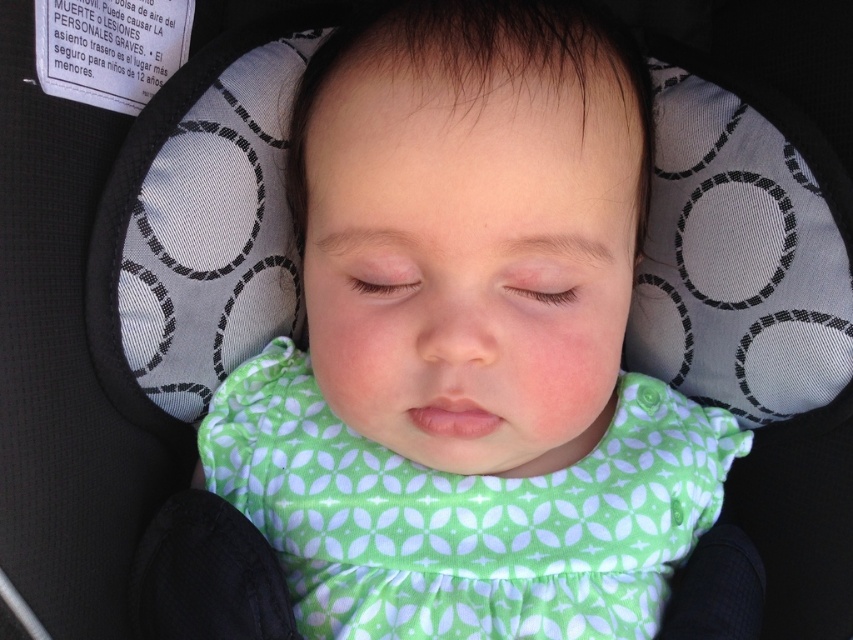
Can you confirm if green fabric bib at center is positioned below green fabric dress at center?

Actually, green fabric bib at center is above green fabric dress at center.

Which is behind, point (529, 160) or point (686, 540)?

The point (686, 540) is behind.

Find the location of `green fabric bib at center`. green fabric bib at center is located at coordinates (x=469, y=340).